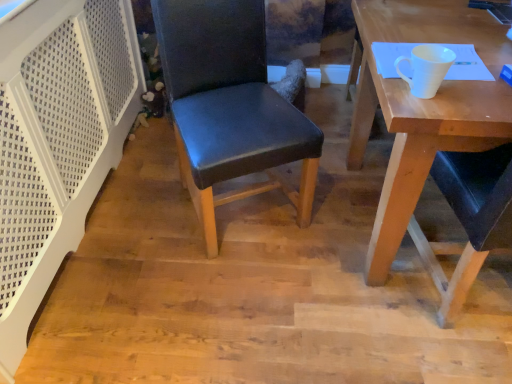
What is the approximate width of white matte cup at upper right?

white matte cup at upper right is 5.94 inches in width.

The height and width of the screenshot is (384, 512). What do you see at coordinates (426, 129) in the screenshot?
I see `wooden desk at right` at bounding box center [426, 129].

Locate an element on the screen. white matte cup at upper right is located at coordinates (426, 68).

From a real-world perspective, between white matte cup at upper right and wooden desk at right, who is vertically lower?

wooden desk at right is physically lower.

Is white matte cup at upper right in front of wooden desk at right?

No, it is behind wooden desk at right.

Where is `desk that appears on the right of white matte cup at upper right`? The width and height of the screenshot is (512, 384). desk that appears on the right of white matte cup at upper right is located at coordinates (426, 129).

Is white matte cup at upper right spatially inside wooden desk at right, or outside of it?

white matte cup at upper right lies outside wooden desk at right.

Based on the photo, is white matte cup at upper right positioned with its back to black leather chair at center?

That's not correct — white matte cup at upper right is not looking away from black leather chair at center.

In the image, is white matte cup at upper right positioned in front of or behind black leather chair at center?

white matte cup at upper right is positioned closer to the viewer than black leather chair at center.

Between white matte cup at upper right and black leather chair at center, which one appears on the left side from the viewer's perspective?

Positioned to the left is black leather chair at center.

Who is smaller, white matte cup at upper right or black leather chair at center?

With smaller size is white matte cup at upper right.

Which is behind, point (197, 48) or point (421, 87)?

Positioned behind is point (197, 48).

Between black leather chair at center and white matte cup at upper right, which one is positioned in front?

Positioned in front is white matte cup at upper right.

In the scene shown: Can you confirm if black leather chair at center is wider than white matte cup at upper right?

Indeed, black leather chair at center has a greater width compared to white matte cup at upper right.

Is black leather chair at center directly adjacent to white matte cup at upper right?

No, black leather chair at center is not in contact with white matte cup at upper right.

Between wooden desk at right and white matte cup at upper right, which one has larger width?

With larger width is wooden desk at right.

Who is bigger, wooden desk at right or white matte cup at upper right?

wooden desk at right is bigger.

Can you confirm if wooden desk at right is positioned to the left of white matte cup at upper right?

In fact, wooden desk at right is to the right of white matte cup at upper right.

Would you say wooden desk at right is a long distance from white matte cup at upper right?

Actually, wooden desk at right and white matte cup at upper right are a little close together.

Is black leather chair at center turned away from wooden desk at right?

black leather chair at center does not have its back to wooden desk at right.

Is black leather chair at center surrounding wooden desk at right?

Definitely not — wooden desk at right is not inside black leather chair at center.

Does black leather chair at center have a greater height compared to wooden desk at right?

Correct, black leather chair at center is much taller as wooden desk at right.

Is wooden desk at right completely or partially outside of black leather chair at center?

That's correct, wooden desk at right is outside of black leather chair at center.

Is wooden desk at right not near black leather chair at center?

They are positioned close to each other.

Is the depth of wooden desk at right less than that of black leather chair at center?

Yes, wooden desk at right is closer to the camera.

Locate an element on the screen. This screenshot has height=384, width=512. desk on the right of black leather chair at center is located at coordinates (426, 129).

Identify the location of coffee cup behind the wooden desk at right. (426, 68).

Where is `chair beneath the white matte cup at upper right (from a real-world perspective)`? The height and width of the screenshot is (384, 512). chair beneath the white matte cup at upper right (from a real-world perspective) is located at coordinates (230, 106).

Looking at the image, which one is located further to white matte cup at upper right, black leather chair at center or wooden desk at right?

black leather chair at center lies further to white matte cup at upper right than the other object.

Consider the image. Estimate the real-world distances between objects in this image. Which object is further from white matte cup at upper right, wooden desk at right or black leather chair at center?

black leather chair at center is positioned further to the anchor white matte cup at upper right.

Estimate the real-world distances between objects in this image. Which object is closer to wooden desk at right, white matte cup at upper right or black leather chair at center?

The object closer to wooden desk at right is white matte cup at upper right.

Estimate the real-world distances between objects in this image. Which object is further from black leather chair at center, white matte cup at upper right or wooden desk at right?

white matte cup at upper right.

When comparing their distances from black leather chair at center, does wooden desk at right or white matte cup at upper right seem closer?

wooden desk at right lies closer to black leather chair at center than the other object.

Which object lies nearer to the anchor point wooden desk at right, black leather chair at center or white matte cup at upper right?

white matte cup at upper right is closer to wooden desk at right.

Where is `coffee cup situated between black leather chair at center and wooden desk at right from left to right`? The image size is (512, 384). coffee cup situated between black leather chair at center and wooden desk at right from left to right is located at coordinates (426, 68).